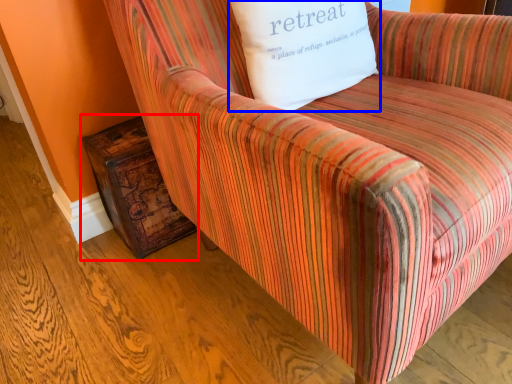
Question: Which object appears farthest to the camera in this image, side table (highlighted by a red box) or pillow (highlighted by a blue box)?

Choices:
 (A) side table
 (B) pillow

Answer: (A)